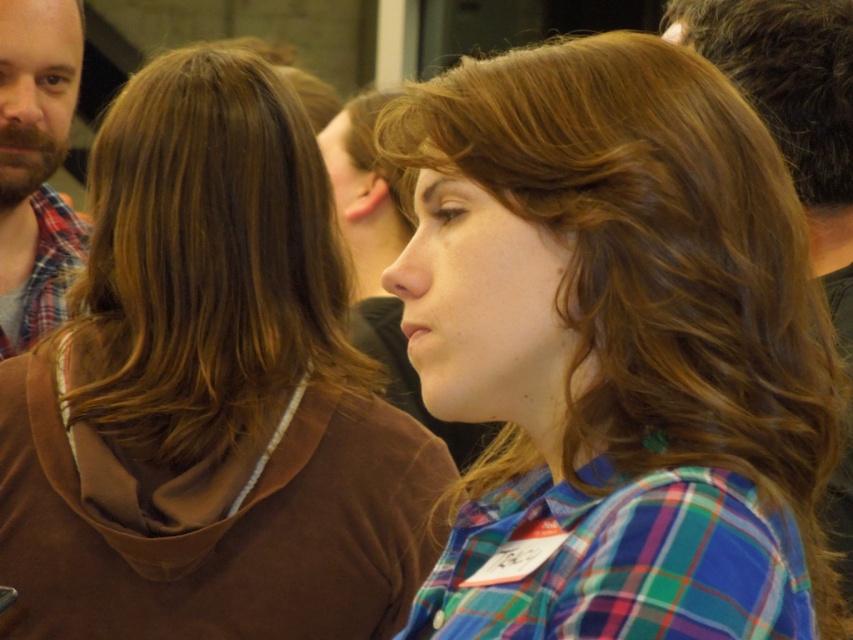
Is plaid fabric shirt at center above brown fleece at upper center?

Indeed, plaid fabric shirt at center is positioned over brown fleece at upper center.

Between plaid fabric shirt at center and brown fleece at upper center, which one appears on the left side from the viewer's perspective?

Positioned to the left is brown fleece at upper center.

You are a GUI agent. You are given a task and a screenshot of the screen. Output one action in this format:
    pyautogui.click(x=<x>, y=<y>)
    Task: Click on the plaid fabric shirt at center
    
    Given the screenshot: What is the action you would take?
    pyautogui.click(x=618, y=348)

In order to click on plaid fabric shirt at center in this screenshot , I will do `click(618, 348)`.

Is dark brown curly hair at upper right positioned before brown wavy hair at upper center?

Yes, it is in front of brown wavy hair at upper center.

Is dark brown curly hair at upper right smaller than brown wavy hair at upper center?

Indeed, dark brown curly hair at upper right has a smaller size compared to brown wavy hair at upper center.

Find the location of a particular element. dark brown curly hair at upper right is located at coordinates (786, 77).

Is point (96, 524) closer to camera compared to point (357, 106)?

Yes, point (96, 524) is closer to viewer.

Between brown fleece at upper center and brown wavy hair at upper center, which one has less height?

brown wavy hair at upper center

Is point (222, 188) positioned after point (346, 104)?

No.

Image resolution: width=853 pixels, height=640 pixels. Identify the location of brown fleece at upper center. (209, 394).